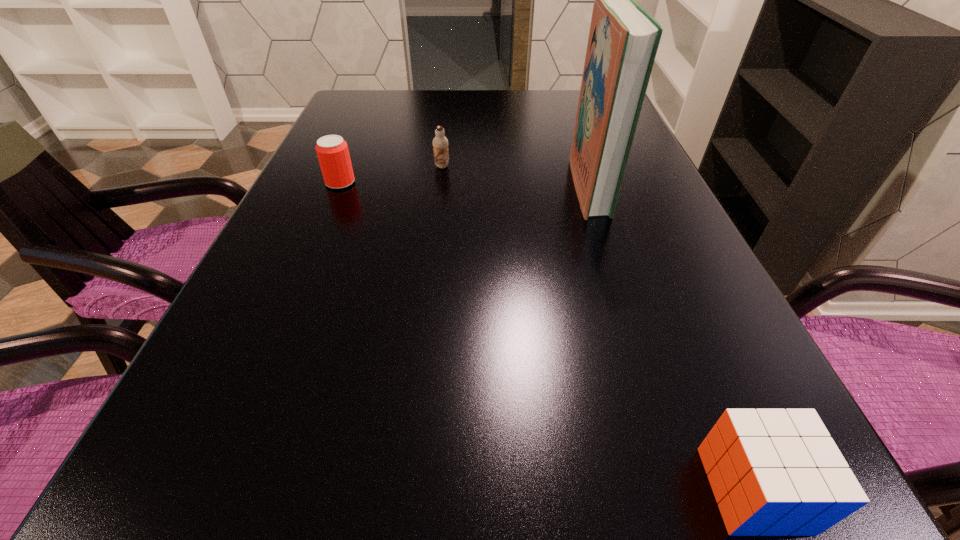
At what (x,y) coordinates should I click in order to perform the action: click on unoccupied area between the tallest object and the cube. Please return your answer as a coordinate pair (x, y). Looking at the image, I should click on (671, 338).

You are a GUI agent. You are given a task and a screenshot of the screen. Output one action in this format:
    pyautogui.click(x=<x>, y=<y>)
    Task: Click on the empty location between the cube and the beer can
    This screenshot has width=960, height=540.
    Given the screenshot: What is the action you would take?
    pyautogui.click(x=547, y=336)

This screenshot has height=540, width=960. What are the coordinates of `unoccupied position between the beer can and the cube` in the screenshot? It's located at (547, 336).

Find the location of `vacant area between the hardback book and the chocolate milk`. vacant area between the hardback book and the chocolate milk is located at coordinates (516, 176).

In order to click on free space that is in between the beer can and the nearest object in this screenshot , I will do tap(547, 336).

Locate an element on the screen. The image size is (960, 540). empty location between the beer can and the cube is located at coordinates (547, 336).

The image size is (960, 540). Find the location of `empty location between the beer can and the tallest object`. empty location between the beer can and the tallest object is located at coordinates (465, 184).

Find the location of a particular element. Image resolution: width=960 pixels, height=540 pixels. vacant region between the tallest object and the nearest object is located at coordinates (671, 338).

Where is `vacant area that lies between the nearest object and the second object from left to right`? Image resolution: width=960 pixels, height=540 pixels. vacant area that lies between the nearest object and the second object from left to right is located at coordinates (598, 328).

At what (x,y) coordinates should I click in order to perform the action: click on the third closest object to the chocolate milk. Please return your answer as a coordinate pair (x, y). The width and height of the screenshot is (960, 540). Looking at the image, I should click on (774, 472).